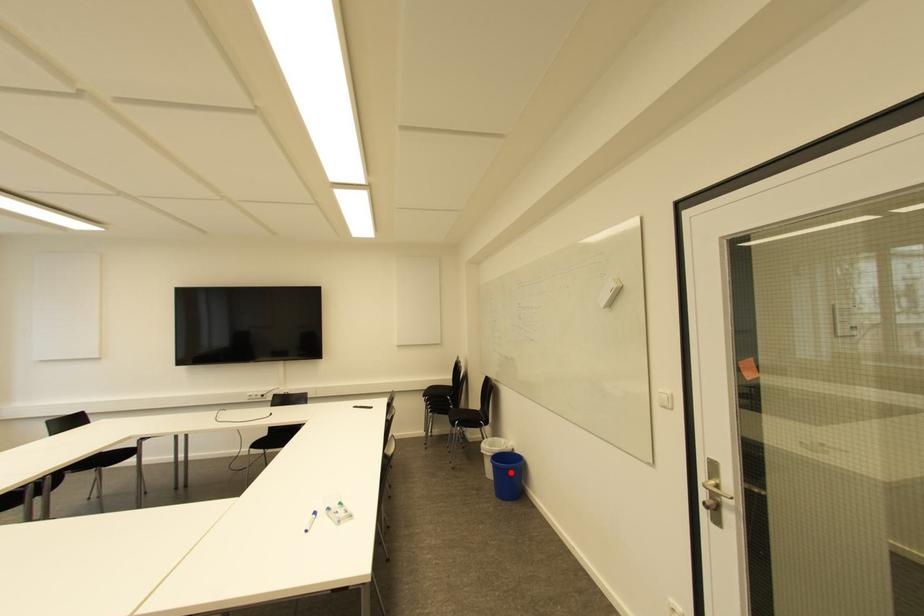
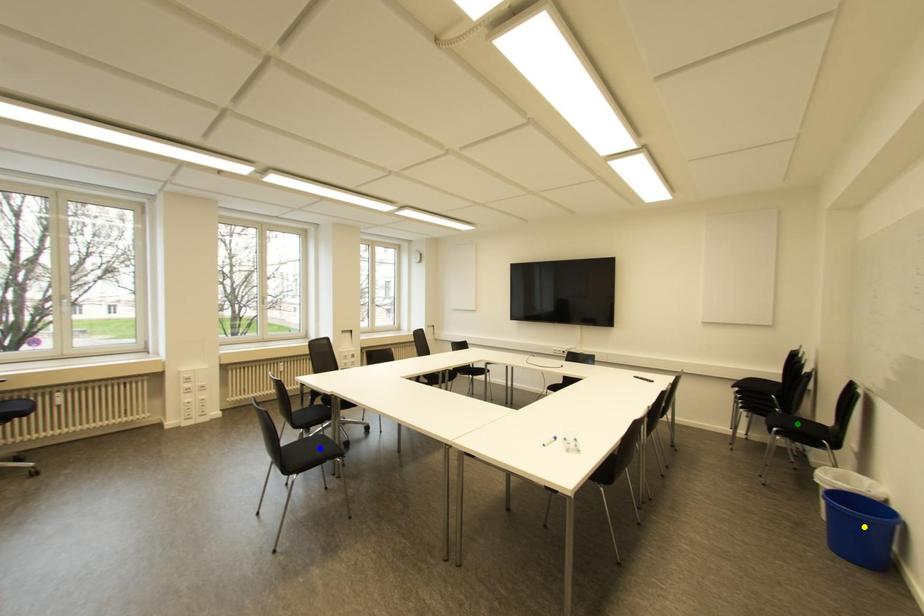
Question: I am providing you with two images of the same scene from different viewpoints. A red point is marked on the first image. You are given multiple points on the second image. Which mark in image 2 goes with the point in image 1?

Choices:
 (A) green point
 (B) blue point
 (C) yellow point

Answer: (C)